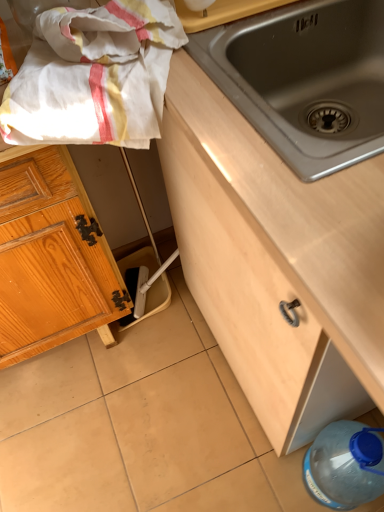
In order to face wooden cabinet at left, the second cabinetry from the right, should I rotate leftwards or rightwards?

A 23.488 degree turn to the left will do.

The height and width of the screenshot is (512, 384). Describe the element at coordinates (94, 76) in the screenshot. I see `white cotton towel at upper left` at that location.

Where is `blue translucent bottle at lower right`? This screenshot has width=384, height=512. blue translucent bottle at lower right is located at coordinates (345, 465).

Considering the sizes of objects wooden cabinet at left, the 1th cabinetry in the left-to-right sequence, and stainless steel sink at center in the image provided, who is shorter, wooden cabinet at left, the 1th cabinetry in the left-to-right sequence, or stainless steel sink at center?

stainless steel sink at center.

Between wooden cabinet at left, the second cabinetry from the right, and stainless steel sink at center, which one has larger width?

stainless steel sink at center is wider.

Between wooden cabinet at left, the 1th cabinetry in the left-to-right sequence, and stainless steel sink at center, which one appears on the left side from the viewer's perspective?

wooden cabinet at left, the 1th cabinetry in the left-to-right sequence, is more to the left.

Is stainless steel sink at center touching wooden cabinet at left, the second cabinetry from the right?

stainless steel sink at center is not next to wooden cabinet at left, the second cabinetry from the right, and they're not touching.

Consider the image. What's the angular difference between stainless steel sink at center and wooden cabinet at left, the second cabinetry from the right,'s facing directions?

Result: 88.8 degrees separate the facing orientations of stainless steel sink at center and wooden cabinet at left, the second cabinetry from the right.

Visually, is stainless steel sink at center positioned to the left or to the right of wooden cabinet at left, the 1th cabinetry in the left-to-right sequence?

Clearly, stainless steel sink at center is on the right of wooden cabinet at left, the 1th cabinetry in the left-to-right sequence, in the image.

Is point (266, 61) positioned in front of point (58, 242)?

That is True.

Could you tell me if stainless steel sink at center is turned towards wooden cabinet at center, which is counted as the 2th cabinetry, starting from the left?

Yes, stainless steel sink at center is aimed at wooden cabinet at center, which is counted as the 2th cabinetry, starting from the left.

Which is more to the right, stainless steel sink at center or wooden cabinet at center, which is counted as the first cabinetry, starting from the right?

Positioned to the right is wooden cabinet at center, which is counted as the first cabinetry, starting from the right.

Between point (383, 19) and point (163, 157), which one is positioned behind?

The point (163, 157) is behind.

From a real-world perspective, is stainless steel sink at center physically located above or below wooden cabinet at center, which is counted as the 2th cabinetry, starting from the left?

Clearly, from a real-world perspective, stainless steel sink at center is above wooden cabinet at center, which is counted as the 2th cabinetry, starting from the left.

Between wooden cabinet at left, the second cabinetry from the right, and blue translucent bottle at lower right, which one has smaller size?

With smaller size is blue translucent bottle at lower right.

Based on the photo, considering the sizes of objects wooden cabinet at left, the second cabinetry from the right, and blue translucent bottle at lower right in the image provided, who is thinner, wooden cabinet at left, the second cabinetry from the right, or blue translucent bottle at lower right?

With smaller width is blue translucent bottle at lower right.

Is wooden cabinet at left, the 1th cabinetry in the left-to-right sequence, taller than blue translucent bottle at lower right?

Correct, wooden cabinet at left, the 1th cabinetry in the left-to-right sequence, is much taller as blue translucent bottle at lower right.

Relative to blue translucent bottle at lower right, is wooden cabinet at left, the second cabinetry from the right, in front or behind?

In the image, wooden cabinet at left, the second cabinetry from the right, appears in front of blue translucent bottle at lower right.

Locate an element on the screen. cabinetry that appears below the wooden cabinet at center, which is counted as the first cabinetry, starting from the right (from a real-world perspective) is located at coordinates (52, 258).

Is wooden cabinet at center, which is counted as the 2th cabinetry, starting from the left, not close to wooden cabinet at left, the 1th cabinetry in the left-to-right sequence?

No, wooden cabinet at center, which is counted as the 2th cabinetry, starting from the left, is not far away from wooden cabinet at left, the 1th cabinetry in the left-to-right sequence.

Does wooden cabinet at center, which is counted as the 2th cabinetry, starting from the left, have a lesser width compared to wooden cabinet at left, the 1th cabinetry in the left-to-right sequence?

In fact, wooden cabinet at center, which is counted as the 2th cabinetry, starting from the left, might be wider than wooden cabinet at left, the 1th cabinetry in the left-to-right sequence.

Looking at this image, considering the sizes of blue translucent bottle at lower right and stainless steel sink at center in the image, is blue translucent bottle at lower right wider or thinner than stainless steel sink at center?

Clearly, blue translucent bottle at lower right has less width compared to stainless steel sink at center.

I want to click on bottle behind the stainless steel sink at center, so click(345, 465).

From a real-world perspective, which object rests below the other?

blue translucent bottle at lower right.

From the picture: Is blue translucent bottle at lower right beside stainless steel sink at center?

No, blue translucent bottle at lower right is not beside stainless steel sink at center.

From the picture: Does stainless steel sink at center have a lesser width compared to blue translucent bottle at lower right?

No.

From a real-world perspective, is stainless steel sink at center under blue translucent bottle at lower right?

No, from a real-world perspective, stainless steel sink at center is not beneath blue translucent bottle at lower right.

Which is behind, stainless steel sink at center or blue translucent bottle at lower right?

blue translucent bottle at lower right is behind.

Is stainless steel sink at center positioned far away from blue translucent bottle at lower right?

No, stainless steel sink at center is not far from blue translucent bottle at lower right.

Find the location of a particular element. This screenshot has height=512, width=384. sink lying in front of the wooden cabinet at left, the second cabinetry from the right is located at coordinates (305, 80).

Where is `sink that appears above the wooden cabinet at left, the second cabinetry from the right (from a real-world perspective)`? Image resolution: width=384 pixels, height=512 pixels. sink that appears above the wooden cabinet at left, the second cabinetry from the right (from a real-world perspective) is located at coordinates (305, 80).

Consider the image. From the image, which object appears to be nearer to blue translucent bottle at lower right, stainless steel sink at center or wooden cabinet at center, which is counted as the 2th cabinetry, starting from the left?

wooden cabinet at center, which is counted as the 2th cabinetry, starting from the left.

Estimate the real-world distances between objects in this image. Which object is further from white cotton towel at upper left, stainless steel sink at center or wooden cabinet at center, which is counted as the first cabinetry, starting from the right?

wooden cabinet at center, which is counted as the first cabinetry, starting from the right.

Which object lies further to the anchor point stainless steel sink at center, blue translucent bottle at lower right or wooden cabinet at center, which is counted as the first cabinetry, starting from the right?

Based on the image, blue translucent bottle at lower right appears to be further to stainless steel sink at center.

Based on their spatial positions, is blue translucent bottle at lower right or wooden cabinet at center, which is counted as the first cabinetry, starting from the right, further from wooden cabinet at left, the second cabinetry from the right?

The object further to wooden cabinet at left, the second cabinetry from the right, is blue translucent bottle at lower right.

When comparing their distances from blue translucent bottle at lower right, does white cotton towel at upper left or stainless steel sink at center seem closer?

stainless steel sink at center is closer to blue translucent bottle at lower right.

When comparing their distances from wooden cabinet at left, the second cabinetry from the right, does white cotton towel at upper left or blue translucent bottle at lower right seem closer?

Among the two, white cotton towel at upper left is located nearer to wooden cabinet at left, the second cabinetry from the right.

Based on their spatial positions, is wooden cabinet at center, which is counted as the 2th cabinetry, starting from the left, or wooden cabinet at left, the second cabinetry from the right, further from blue translucent bottle at lower right?

Based on the image, wooden cabinet at left, the second cabinetry from the right, appears to be further to blue translucent bottle at lower right.

Considering their positions, is blue translucent bottle at lower right positioned further to white cotton towel at upper left than wooden cabinet at left, the 1th cabinetry in the left-to-right sequence?

The object further to white cotton towel at upper left is blue translucent bottle at lower right.

Identify the location of bottle located between wooden cabinet at left, the second cabinetry from the right, and wooden cabinet at center, which is counted as the 2th cabinetry, starting from the left, in the left-right direction. Image resolution: width=384 pixels, height=512 pixels. (345, 465).

You are a GUI agent. You are given a task and a screenshot of the screen. Output one action in this format:
    pyautogui.click(x=<x>, y=<y>)
    Task: Click on the sink between wooden cabinet at left, the second cabinetry from the right, and wooden cabinet at center, which is counted as the first cabinetry, starting from the right, in the horizontal direction
    The image size is (384, 512).
    Given the screenshot: What is the action you would take?
    (305, 80)

The width and height of the screenshot is (384, 512). I want to click on blanket situated between wooden cabinet at left, the second cabinetry from the right, and wooden cabinet at center, which is counted as the first cabinetry, starting from the right, from left to right, so click(x=94, y=76).

Where is `sink between white cotton towel at upper left and wooden cabinet at center, which is counted as the first cabinetry, starting from the right, from left to right`? The height and width of the screenshot is (512, 384). sink between white cotton towel at upper left and wooden cabinet at center, which is counted as the first cabinetry, starting from the right, from left to right is located at coordinates (305, 80).